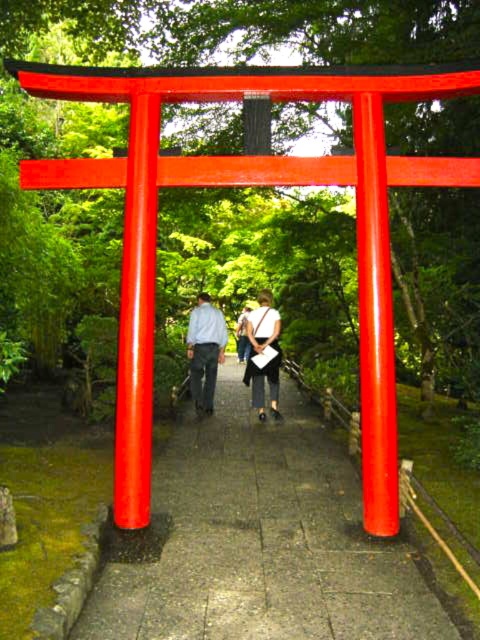
Does matte blue shirt at center come in front of light blue shirt at center?

Yes, it is.

Does matte blue shirt at center have a greater width compared to light blue shirt at center?

In fact, matte blue shirt at center might be narrower than light blue shirt at center.

Is point (262, 298) positioned in front of point (196, 326)?

That is True.

Image resolution: width=480 pixels, height=640 pixels. I want to click on matte blue shirt at center, so click(262, 349).

Can you confirm if light blue shirt at center is taller than matte white bag at center?

In fact, light blue shirt at center may be shorter than matte white bag at center.

Does light blue shirt at center appear under matte white bag at center?

Incorrect, light blue shirt at center is not positioned below matte white bag at center.

Is point (210, 304) less distant than point (245, 385)?

Yes, point (210, 304) is closer to viewer.

Find the location of a particular element. This screenshot has width=480, height=640. light blue shirt at center is located at coordinates (204, 352).

Is matte blue shirt at center bigger than matte white bag at center?

Actually, matte blue shirt at center might be smaller than matte white bag at center.

Find the location of a particular element. matte blue shirt at center is located at coordinates (262, 349).